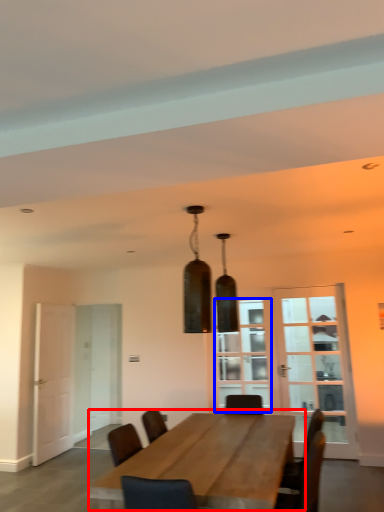
Question: Among these objects, which one is nearest to the camera, table (highlighted by a red box) or window (highlighted by a blue box)?

Choices:
 (A) table
 (B) window

Answer: (A)